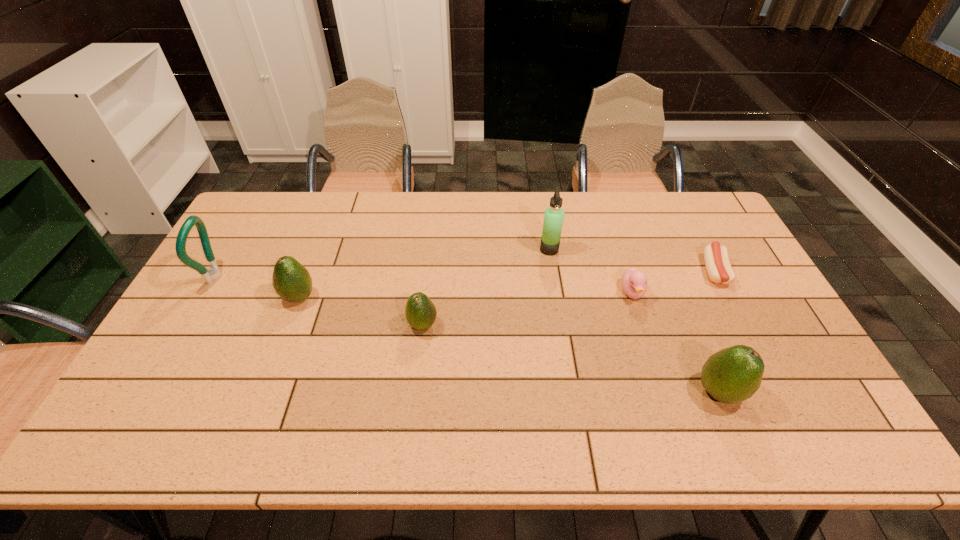
Please point a spot to place another avocado for symmetrical spacing. Please provide its 2D coordinates. Your answer should be formatted as a tuple, i.e. [(x, y)], where the tuple contains the x and y coordinates of a point satisfying the conditions above.

[(562, 356)]